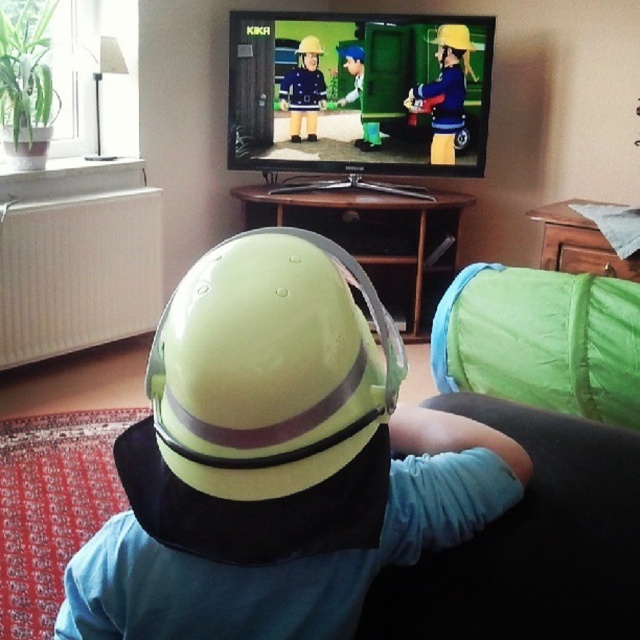
You are a parent trying to ensure your child is sitting safely while watching TV. You notice the blue fabric at lower right and the yellow matte helmet at upper center in the scene. Which object is closer to your child to check for safety?

The blue fabric at lower right is closer to the viewer than the yellow matte helmet at upper center, so the parent should check the blue fabric at lower right first as it is nearer to the child.

You are a parent trying to find your child a hat. You see the blue fabric at lower right and the blue fabric hat at center. Which one is closer to you?

The blue fabric at lower right is in front of the blue fabric hat at center, so the blue fabric at lower right is closer to you.

From the picture: You are a toy designer who wants to create a display stand for both the yellow matte helmet at upper center and the blue fabric hat at center. The stand must place them exactly 20 inches apart. Can you fit them on a shelf that is 24 inches wide?

The yellow matte helmet at upper center is 20.05 inches from the blue fabric hat at center. Since the shelf is 24 inches wide, which is slightly wider than the required 20 inches, the two items can be placed on the shelf with a small amount of space remaining between them and the edges.